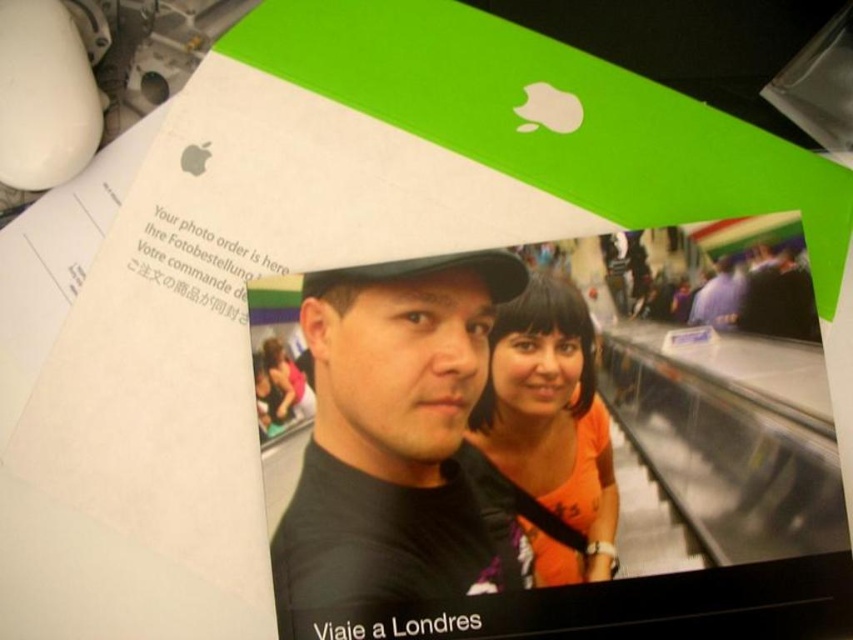
Can you confirm if black matte shirt at center is smaller than orange matte shirt at center?

No, black matte shirt at center is not smaller than orange matte shirt at center.

Is point (457, 342) positioned after point (576, 524)?

Yes, it is.

At what (x,y) coordinates should I click in order to perform the action: click on black matte shirt at center. Please return your answer as a coordinate pair (x, y). Image resolution: width=853 pixels, height=640 pixels. Looking at the image, I should click on [393, 440].